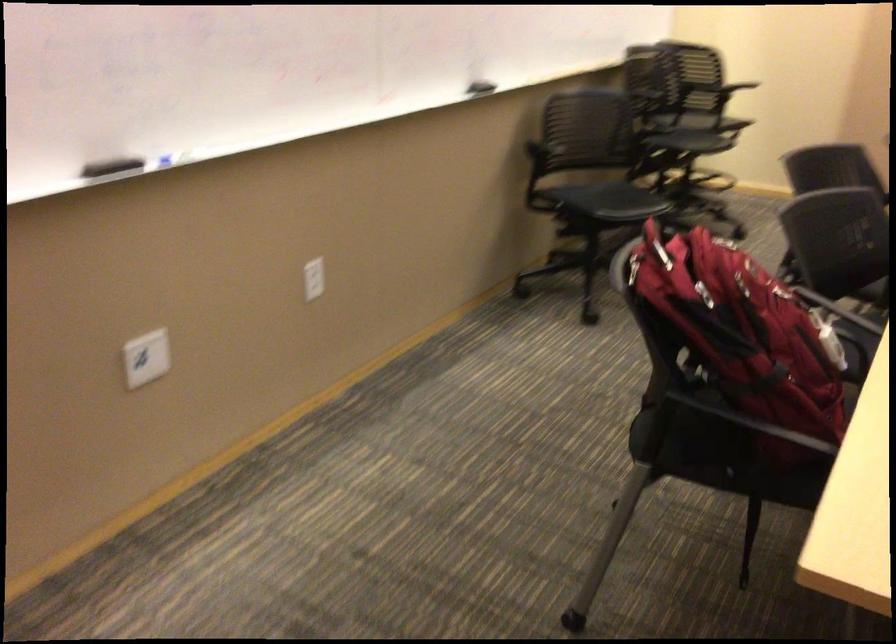
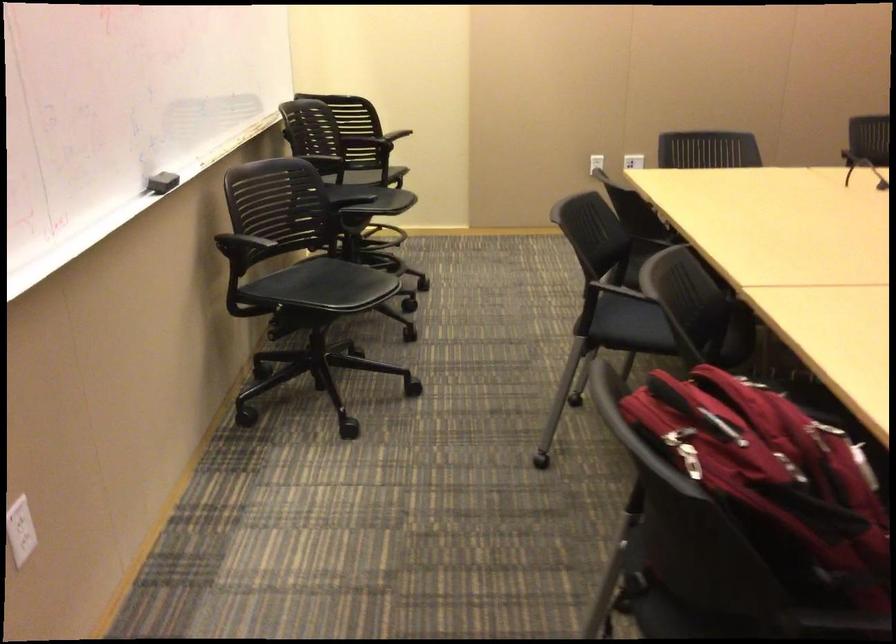
Find the pixel in the second image that matches the point at 478,86 in the first image.

(161, 182)